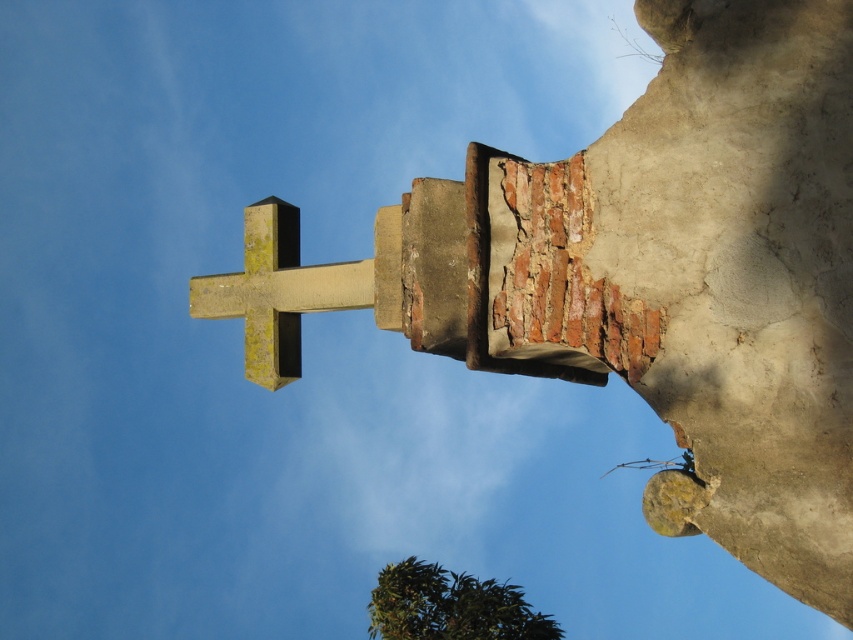
You are a landscape architect planning to install a new pathway between the green mossy stone cross at center and the green leafy tree at lower center. Given that the pathway must be at least 2 meters wide, can you confirm if there is enough space between them based on their widths?

The green mossy stone cross at center is narrower than the green leafy tree at lower center. However, the exact widths are not provided, so it is impossible to determine if the 2 meter pathway requirement can be met without additional measurements.

You are standing in front of a stone cross and a brick pedestal. According to the scene, where is the point located at coordinates (277, 291)?

The point at coordinates (277, 291) corresponds to the green mossy stone cross at center.